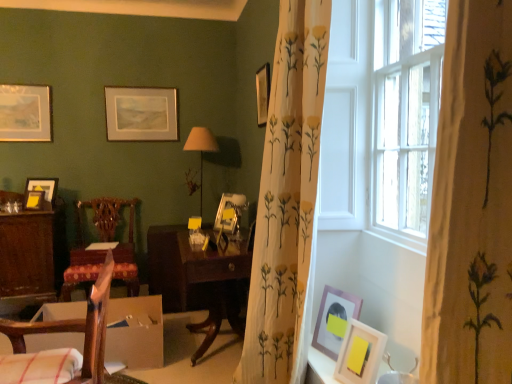
Question: Can you confirm if matte silver picture frame at upper left, the 1th picture frame in the left-to-right sequence, is shorter than wooden picture frame at lower right, placed as the eighth picture frame when sorted from left to right?

Choices:
 (A) yes
 (B) no

Answer: (B)

Question: Does matte silver picture frame at upper left, placed as the 8th picture frame when sorted from right to left, have a smaller size compared to wooden picture frame at lower right, placed as the eighth picture frame when sorted from left to right?

Choices:
 (A) no
 (B) yes

Answer: (A)

Question: From the image's perspective, is matte silver picture frame at upper left, arranged as the seventh picture frame when viewed from the front, above wooden picture frame at lower right, the 1th picture frame when ordered from front to back?

Choices:
 (A) yes
 (B) no

Answer: (A)

Question: Can you confirm if matte silver picture frame at upper left, arranged as the seventh picture frame when viewed from the front, is bigger than wooden picture frame at lower right, the 1th picture frame when ordered from front to back?

Choices:
 (A) no
 (B) yes

Answer: (B)

Question: From a real-world perspective, does matte silver picture frame at upper left, placed as the 8th picture frame when sorted from right to left, sit lower than wooden picture frame at lower right, placed as the eighth picture frame when sorted from left to right?

Choices:
 (A) no
 (B) yes

Answer: (A)

Question: Can you confirm if matte silver picture frame at upper left, placed as the 8th picture frame when sorted from right to left, is thinner than wooden picture frame at lower right, placed as the eighth picture frame when sorted from left to right?

Choices:
 (A) yes
 (B) no

Answer: (A)

Question: Can wooden picture frame at upper right, which appears as the 3th picture frame when viewed from the front, be found inside wooden drawer at center?

Choices:
 (A) yes
 (B) no

Answer: (B)

Question: Is wooden drawer at center behind wooden picture frame at upper right, the third picture frame positioned from the right?

Choices:
 (A) yes
 (B) no

Answer: (A)

Question: Is wooden drawer at center oriented away from wooden picture frame at upper right, which ranks as the 6th picture frame in left-to-right order?

Choices:
 (A) no
 (B) yes

Answer: (A)

Question: Does wooden drawer at center appear on the right side of wooden picture frame at upper right, the sixth picture frame from the back?

Choices:
 (A) yes
 (B) no

Answer: (B)

Question: Is wooden drawer at center at the left side of wooden picture frame at upper right, the sixth picture frame from the back?

Choices:
 (A) yes
 (B) no

Answer: (A)

Question: Is wooden drawer at center placed right next to wooden picture frame at upper right, the third picture frame positioned from the right?

Choices:
 (A) yes
 (B) no

Answer: (B)

Question: Is the position of white floral-patterned curtain at center more distant than that of wooden desk at left?

Choices:
 (A) yes
 (B) no

Answer: (B)